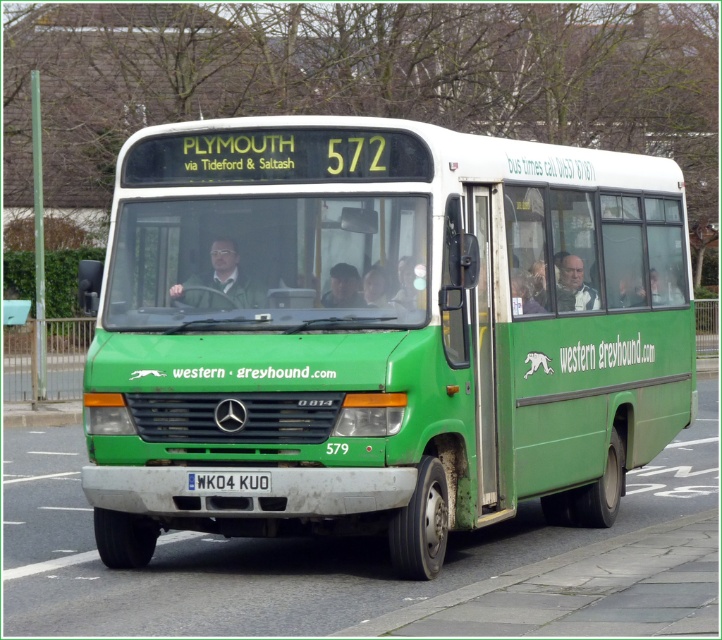
Does point (208, 284) lie in front of point (321, 304)?

No.

Between green matte jacket at center and dark brown leather jacket at center, which one appears on the right side from the viewer's perspective?

dark brown leather jacket at center

Is point (230, 248) less distant than point (336, 291)?

No, (230, 248) is behind (336, 291).

Identify the location of green matte jacket at center. (219, 282).

Can you confirm if matte black jacket at upper center is shorter than white plastic license plate at center?

In fact, matte black jacket at upper center may be taller than white plastic license plate at center.

Which of these two, matte black jacket at upper center or white plastic license plate at center, stands taller?

matte black jacket at upper center is taller.

Is point (560, 307) farther from camera compared to point (266, 492)?

Yes.

The width and height of the screenshot is (722, 640). I want to click on matte black jacket at upper center, so click(x=573, y=284).

From the picture: Can you confirm if white plastic license plate at center is shorter than dark brown leather jacket at center?

Indeed, white plastic license plate at center has a lesser height compared to dark brown leather jacket at center.

Consider the image. Is white plastic license plate at center to the left of dark brown leather jacket at center from the viewer's perspective?

Yes, white plastic license plate at center is to the left of dark brown leather jacket at center.

Which is in front, point (258, 490) or point (329, 269)?

Positioned in front is point (258, 490).

I want to click on white plastic license plate at center, so click(230, 481).